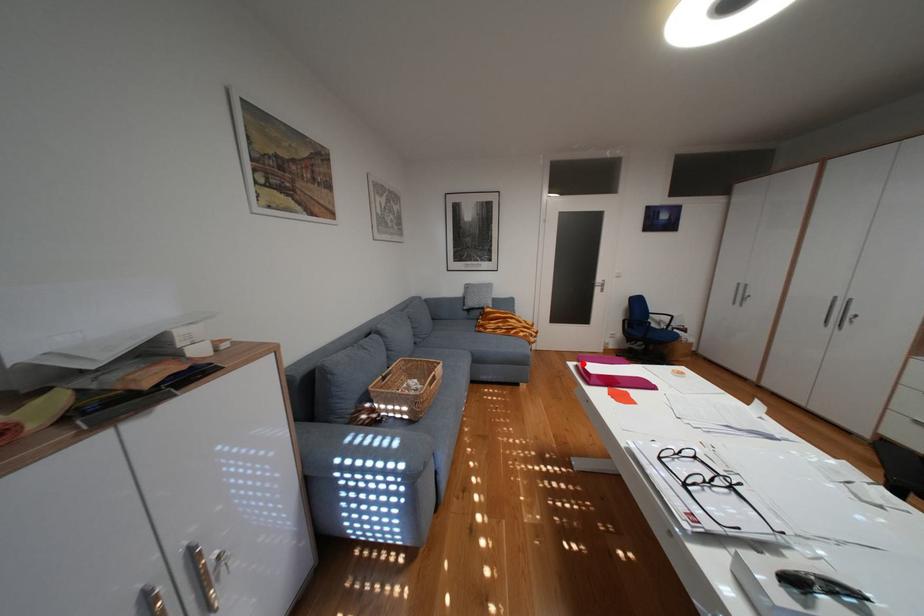
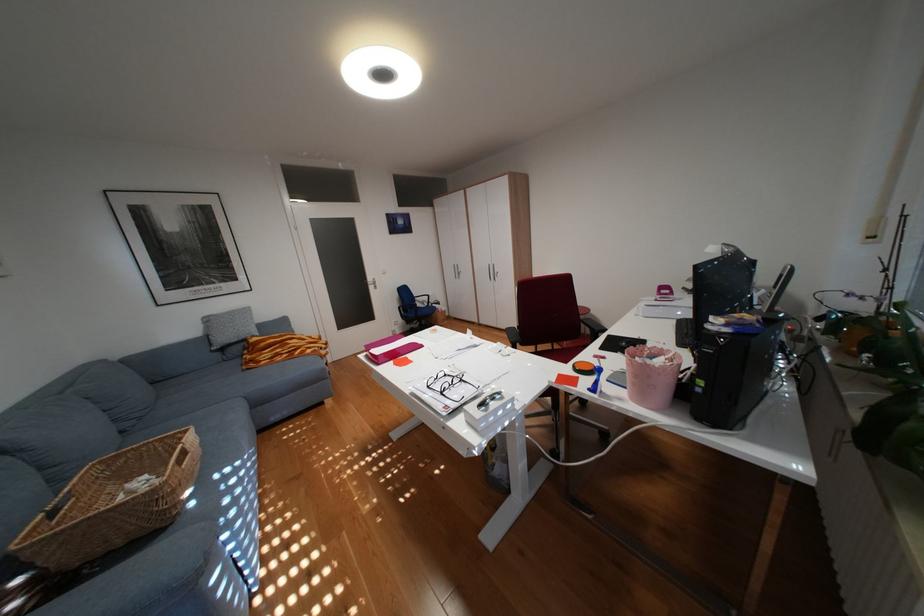
Where in the second image is the point corresponding to the highlighted location from the first image?

(373, 355)